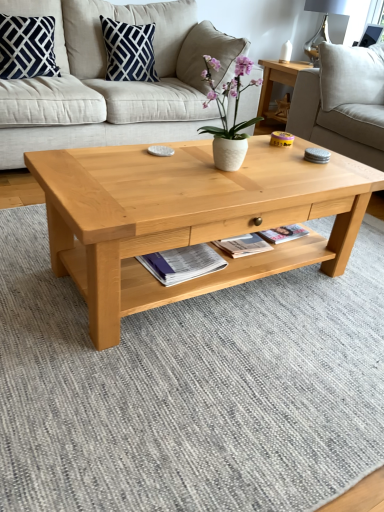
What are the coordinates of `free point above light brown wood coffee table at center (from a real-world perspective)` in the screenshot? It's located at (187, 172).